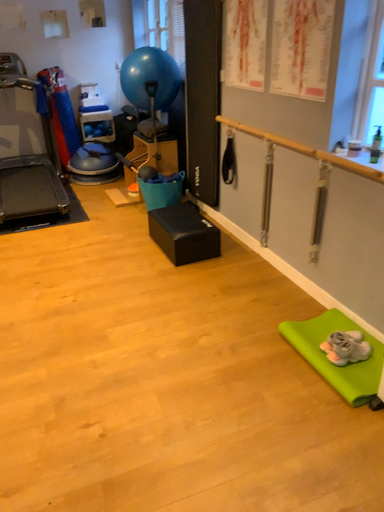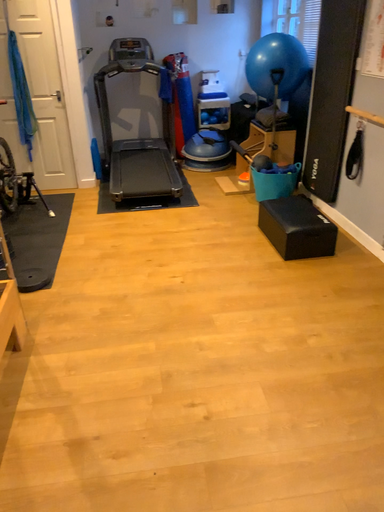
Question: Which way did the camera rotate in the video?

Choices:
 (A) rotated right
 (B) rotated left

Answer: (B)